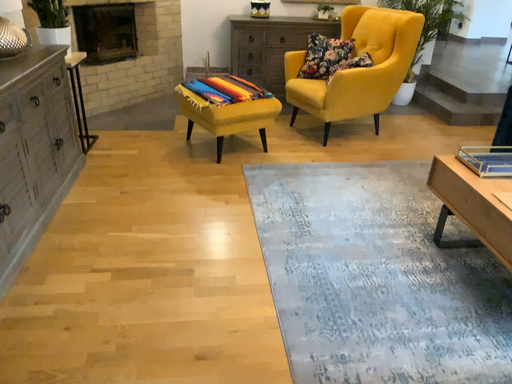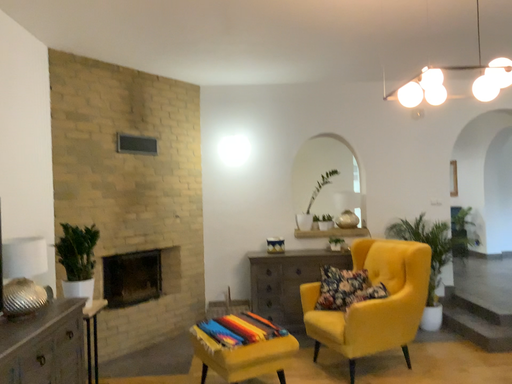
Question: Which way did the camera rotate in the video?

Choices:
 (A) rotated upward
 (B) rotated downward

Answer: (A)